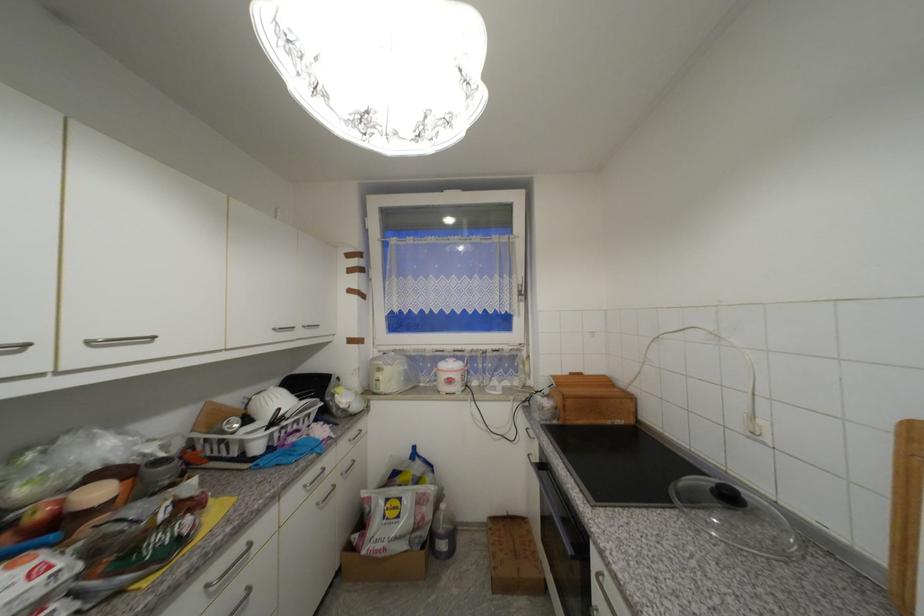
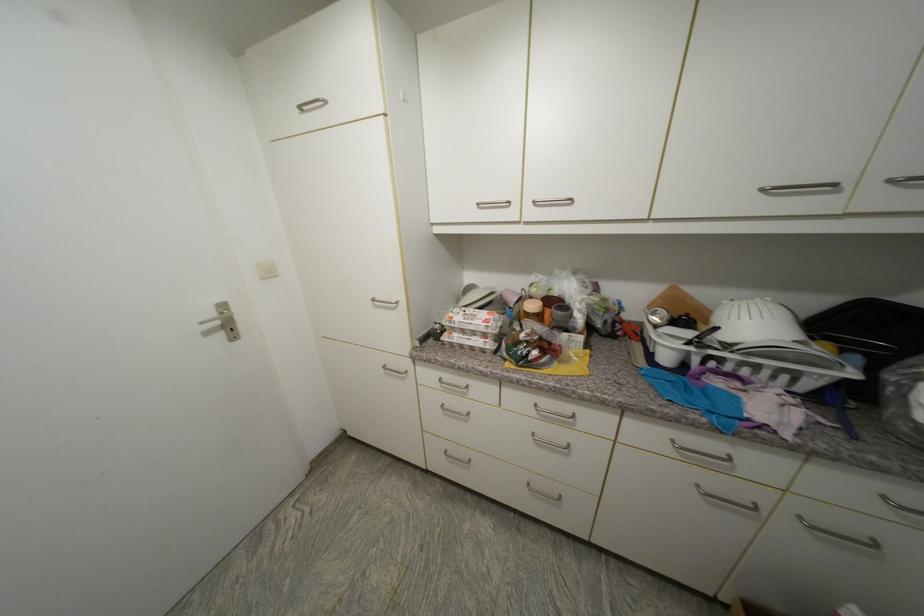
Locate, in the second image, the point that corresponds to point 95,344 in the first image.

(540, 204)